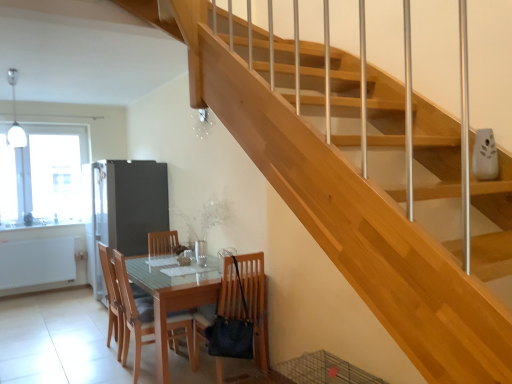
Question: From the image's perspective, relative to light brown wood chair at center, marked as the 2th chair in a right-to-left arrangement, is transparent glass window at upper left above or below?

Choices:
 (A) above
 (B) below

Answer: (A)

Question: Considering the positions of transparent glass window at upper left and light brown wood chair at center, which ranks as the 2th chair in left-to-right order, in the image, is transparent glass window at upper left wider or thinner than light brown wood chair at center, which ranks as the 2th chair in left-to-right order,?

Choices:
 (A) thin
 (B) wide

Answer: (A)

Question: Estimate the real-world distances between objects in this image. Which object is closer to the light wood/wooden chair at lower left, the third chair in the right-to-left sequence?

Choices:
 (A) matte wooden table at center
 (B) satin silver refrigerator at left
 (C) white glossy countertop at lower left
 (D) light brown wood chair at center, marked as the 2th chair in a right-to-left arrangement
 (E) matte brown chair at lower center, acting as the 3th chair starting from the left

Answer: (D)

Question: Based on their relative distances, which object is farther from the white glossy countertop at lower left?

Choices:
 (A) light wood/wooden chair at lower left, the third chair in the right-to-left sequence
 (B) matte wooden table at center
 (C) transparent glass window at upper left
 (D) satin silver refrigerator at left
 (E) light brown wood chair at center, which ranks as the 2th chair in left-to-right order

Answer: (B)